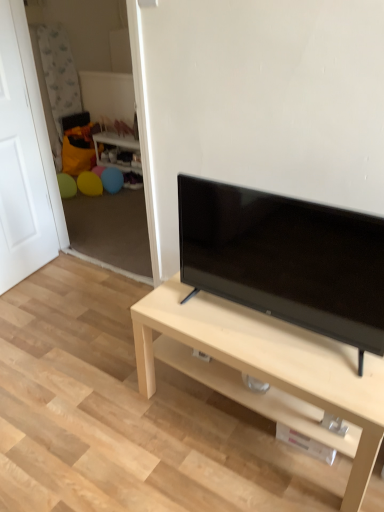
Question: Is light wood/finish tv stand at center positioned with its back to wooden side table at center?

Choices:
 (A) yes
 (B) no

Answer: (B)

Question: From a real-world perspective, is light wood/finish tv stand at center positioned under wooden side table at center based on gravity?

Choices:
 (A) no
 (B) yes

Answer: (A)

Question: Is the depth of light wood/finish tv stand at center less than that of wooden side table at center?

Choices:
 (A) no
 (B) yes

Answer: (B)

Question: Is light wood/finish tv stand at center further to camera compared to wooden side table at center?

Choices:
 (A) yes
 (B) no

Answer: (B)

Question: Is light wood/finish tv stand at center far from wooden side table at center?

Choices:
 (A) yes
 (B) no

Answer: (A)

Question: Is point [0, 120] closer or farther from the camera than point [130, 170]?

Choices:
 (A) closer
 (B) farther

Answer: (A)

Question: From the image's perspective, is white matte door at left above or below wooden side table at center?

Choices:
 (A) above
 (B) below

Answer: (B)

Question: Looking at their shapes, would you say white matte door at left is wider or thinner than wooden side table at center?

Choices:
 (A) wide
 (B) thin

Answer: (B)

Question: Is white matte door at left to the left or to the right of wooden side table at center in the image?

Choices:
 (A) left
 (B) right

Answer: (A)

Question: Does point (362, 284) appear closer or farther from the camera than point (167, 295)?

Choices:
 (A) closer
 (B) farther

Answer: (A)

Question: From their relative heights in the image, would you say black glossy tv at center is taller or shorter than light wood/finish tv stand at center?

Choices:
 (A) short
 (B) tall

Answer: (B)

Question: Is black glossy tv at center bigger or smaller than light wood/finish tv stand at center?

Choices:
 (A) big
 (B) small

Answer: (B)

Question: From a real-world perspective, is black glossy tv at center above or below light wood/finish tv stand at center?

Choices:
 (A) above
 (B) below

Answer: (A)

Question: In terms of height, does light wood/finish tv stand at center look taller or shorter compared to black glossy tv at center?

Choices:
 (A) short
 (B) tall

Answer: (A)

Question: From the image's perspective, is light wood/finish tv stand at center positioned above or below black glossy tv at center?

Choices:
 (A) below
 (B) above

Answer: (A)